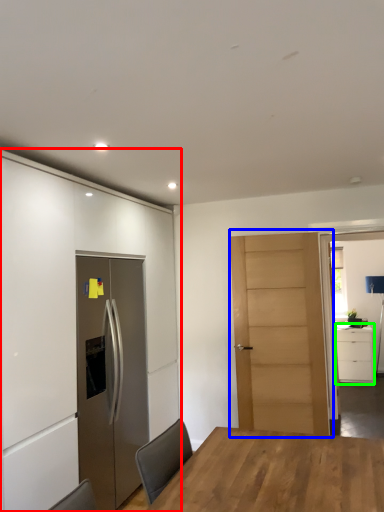
Question: Estimate the real-world distances between objects in this image. Which object is farther from cabinetry (highlighted by a red box), door (highlighted by a blue box) or cabinetry (highlighted by a green box)?

Choices:
 (A) door
 (B) cabinetry

Answer: (B)